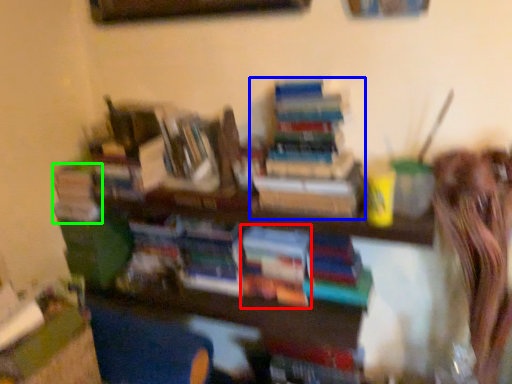
Question: Which object is the closest to the book (highlighted by a red box)? Choose among these: book (highlighted by a blue box) or book (highlighted by a green box).

Choices:
 (A) book
 (B) book

Answer: (A)